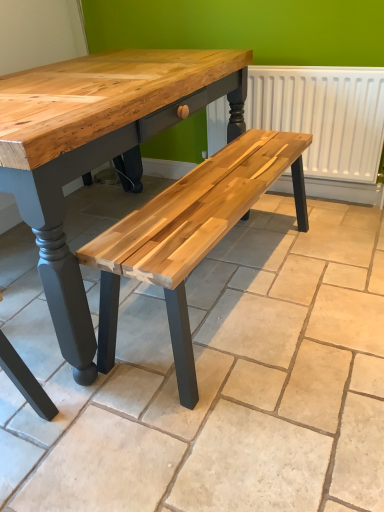
You are a GUI agent. You are given a task and a screenshot of the screen. Output one action in this format:
    pyautogui.click(x=<x>, y=<y>)
    Task: Click on the vacant area on top of natural wood bench at center (from a real-world perspective)
    This screenshot has width=384, height=512.
    Given the screenshot: What is the action you would take?
    pyautogui.click(x=197, y=311)